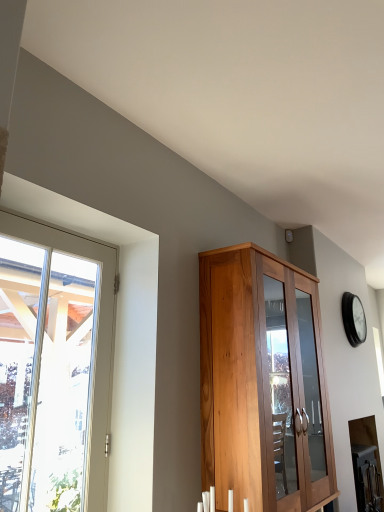
Question: Choose the correct answer: Is clear glass window at left inside black glass clock at upper right or outside it?

Choices:
 (A) outside
 (B) inside

Answer: (A)

Question: Considering the relative positions of clear glass window at left and black glass clock at upper right in the image provided, is clear glass window at left to the left or to the right of black glass clock at upper right?

Choices:
 (A) right
 (B) left

Answer: (B)

Question: Based on their relative distances, which object is farther from the wooden cabinet at center?

Choices:
 (A) black glass clock at upper right
 (B) clear glass window at left

Answer: (A)

Question: Based on their relative distances, which object is nearer to the clear glass window at left?

Choices:
 (A) wooden cabinet at center
 (B) black glass clock at upper right

Answer: (A)